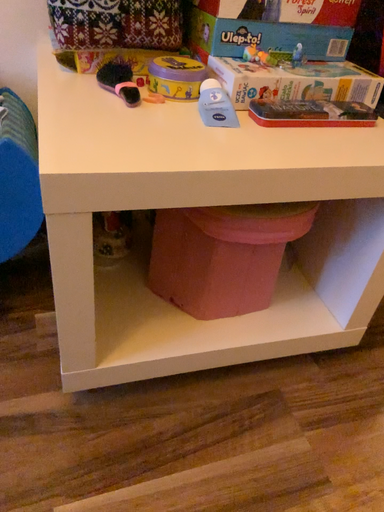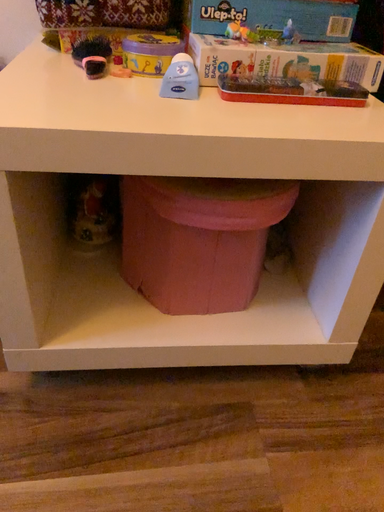
Question: How did the camera likely rotate when shooting the video?

Choices:
 (A) rotated right
 (B) rotated left

Answer: (B)